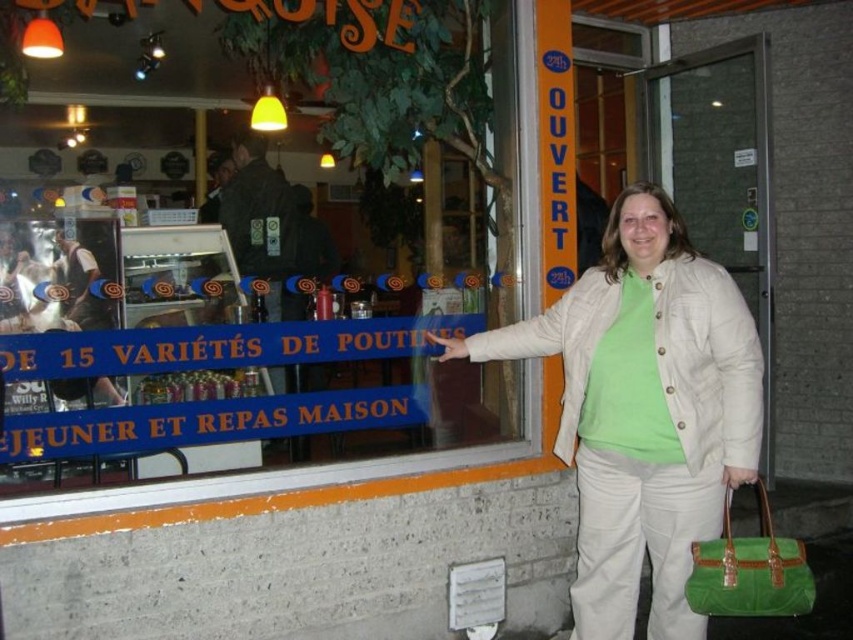
Question: Which of the following is the farthest from the observer?

Choices:
 (A) green fabric handbag at lower right
 (B) light beige quilted jacket at center

Answer: (B)

Question: Which point is closer to the camera?

Choices:
 (A) light beige quilted jacket at center
 (B) white quilted jacket at center
 (C) green fabric handbag at lower right

Answer: (C)

Question: Which point is closer to the camera?

Choices:
 (A) light beige quilted jacket at center
 (B) green fabric handbag at lower right

Answer: (B)

Question: Does light beige quilted jacket at center come behind white quilted jacket at center?

Choices:
 (A) no
 (B) yes

Answer: (A)

Question: Does light beige quilted jacket at center lie behind green fabric handbag at lower right?

Choices:
 (A) no
 (B) yes

Answer: (B)

Question: Does light beige quilted jacket at center have a larger size compared to white quilted jacket at center?

Choices:
 (A) yes
 (B) no

Answer: (A)